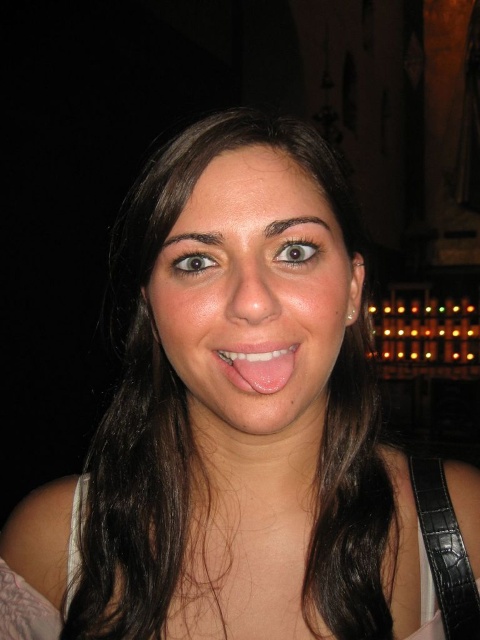
Question: Which object is closer to the camera taking this photo?

Choices:
 (A) black leather strap at lower right
 (B) pink glossy tongue at center

Answer: (B)

Question: Which point is farther from the camera taking this photo?

Choices:
 (A) (266, 376)
 (B) (462, 627)

Answer: (B)

Question: In this image, where is black leather strap at lower right located relative to pink glossy tongue at center?

Choices:
 (A) below
 (B) above

Answer: (A)

Question: Is black leather strap at lower right bigger than pink glossy tongue at center?

Choices:
 (A) no
 (B) yes

Answer: (B)

Question: In this image, where is black leather strap at lower right located relative to pink glossy tongue at center?

Choices:
 (A) left
 (B) right

Answer: (B)